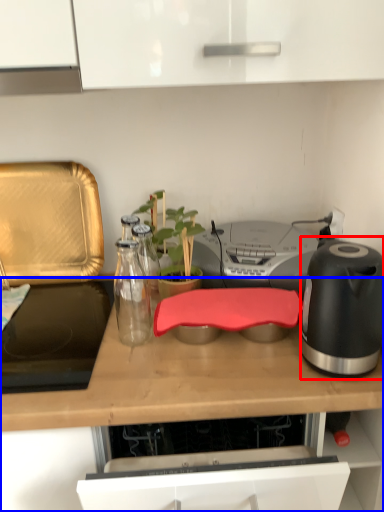
Question: Among these objects, which one is nearest to the camera, kitchen appliance (highlighted by a red box) or countertop (highlighted by a blue box)?

Choices:
 (A) kitchen appliance
 (B) countertop

Answer: (B)